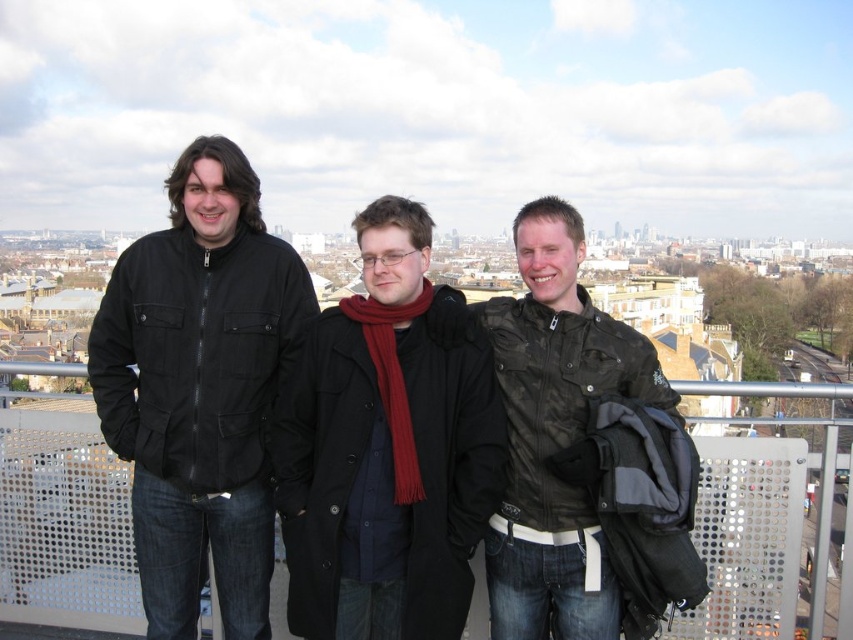
Question: Does matte black coat at center appear over black matte jacket at left?

Choices:
 (A) no
 (B) yes

Answer: (A)

Question: Can you confirm if black matte jacket at left is smaller than camouflage jacket at center?

Choices:
 (A) no
 (B) yes

Answer: (B)

Question: Is matte black coat at center below black matte jacket at left?

Choices:
 (A) no
 (B) yes

Answer: (B)

Question: Which object appears closest to the camera in this image?

Choices:
 (A) camouflage jacket at center
 (B) matte black coat at center
 (C) black matte jacket at left

Answer: (B)

Question: Which of the following is the closest to the observer?

Choices:
 (A) (379, 474)
 (B) (573, 225)

Answer: (A)

Question: Which is nearer to the matte black coat at center?

Choices:
 (A) black matte jacket at left
 (B) camouflage jacket at center

Answer: (B)